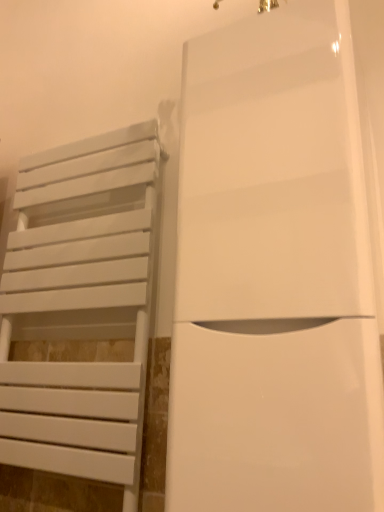
Question: Is white matte towel rack at left beside white glossy door at center?

Choices:
 (A) yes
 (B) no

Answer: (B)

Question: From the image's perspective, does white matte towel rack at left appear higher than white glossy door at center?

Choices:
 (A) yes
 (B) no

Answer: (B)

Question: Is white matte towel rack at left outside of white glossy door at center?

Choices:
 (A) no
 (B) yes

Answer: (B)

Question: From the image's perspective, is white matte towel rack at left below white glossy door at center?

Choices:
 (A) yes
 (B) no

Answer: (A)

Question: Is white matte towel rack at left to the left of white glossy door at center from the viewer's perspective?

Choices:
 (A) yes
 (B) no

Answer: (A)

Question: From a real-world perspective, is white matte towel rack at left physically above white glossy door at center?

Choices:
 (A) no
 (B) yes

Answer: (A)

Question: Can white matte towel rack at left be found inside white glossy door at center?

Choices:
 (A) yes
 (B) no

Answer: (B)

Question: Can you confirm if white glossy door at center is wider than white matte towel rack at left?

Choices:
 (A) yes
 (B) no

Answer: (A)

Question: Does white glossy door at center have a greater height compared to white matte towel rack at left?

Choices:
 (A) yes
 (B) no

Answer: (B)

Question: Could you tell me if white glossy door at center is turned towards white matte towel rack at left?

Choices:
 (A) yes
 (B) no

Answer: (B)

Question: Considering the relative sizes of white glossy door at center and white matte towel rack at left in the image provided, is white glossy door at center smaller than white matte towel rack at left?

Choices:
 (A) yes
 (B) no

Answer: (B)

Question: Considering the relative positions of white glossy door at center and white matte towel rack at left in the image provided, is white glossy door at center to the right of white matte towel rack at left from the viewer's perspective?

Choices:
 (A) no
 (B) yes

Answer: (B)

Question: From a real-world perspective, relative to white glossy door at center, is white matte towel rack at left vertically above or below?

Choices:
 (A) below
 (B) above

Answer: (A)